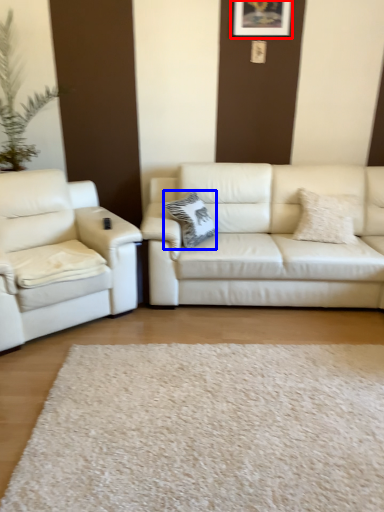
Question: Which object is closer to the camera taking this photo, picture frame (highlighted by a red box) or pillow (highlighted by a blue box)?

Choices:
 (A) picture frame
 (B) pillow

Answer: (B)